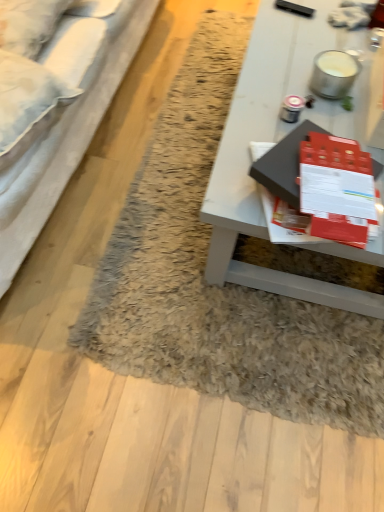
The width and height of the screenshot is (384, 512). I want to click on free space to the back side of matte black book at center, so click(x=300, y=112).